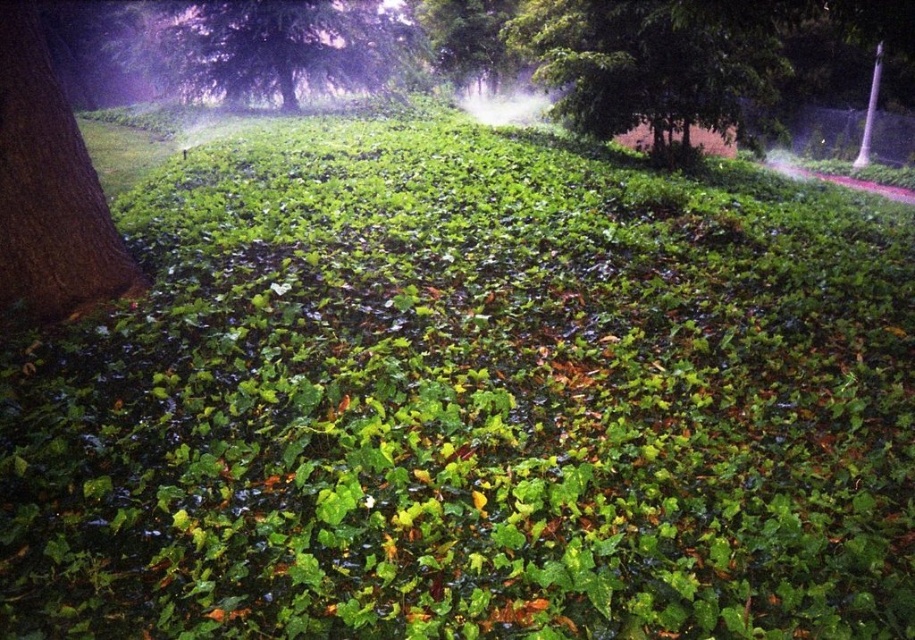
You are standing in the middle of the park and see the green leafy tree at upper center and the brown rough bark tree at left. If you want to walk directly to the closer tree, which one should you head towards?

The brown rough bark tree at left is closer to you than the green leafy tree at upper center since it is only 39.45 feet away from the brown rough bark tree at left, so you should head towards the brown rough bark tree at left.

You are standing in the park and see the brown rough bark tree at left and the green leafy tree at upper left. Which tree is taller?

The green leafy tree at upper left is taller than the brown rough bark tree at left.